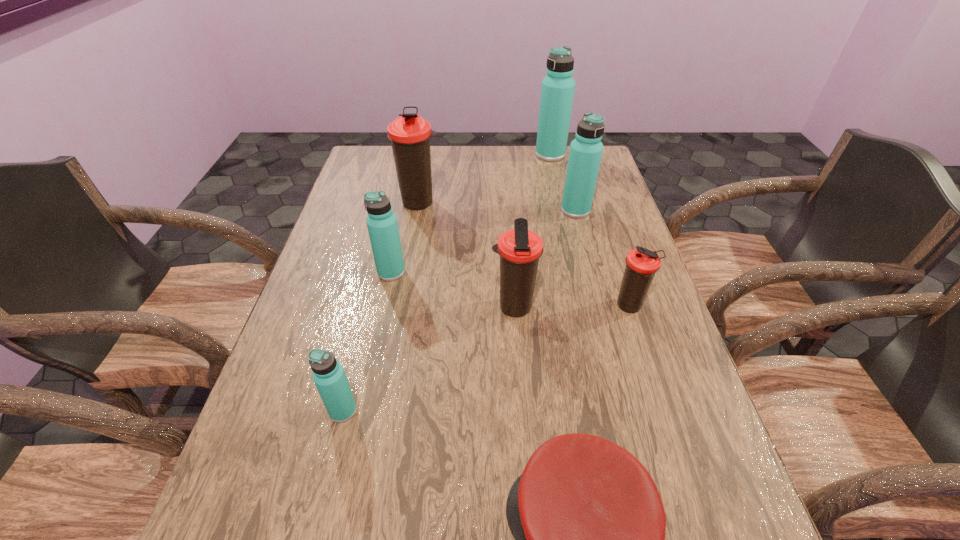
The height and width of the screenshot is (540, 960). Find the location of `the farthest aqua thermos bottle`. the farthest aqua thermos bottle is located at coordinates (557, 92).

Where is `the farthest object`? the farthest object is located at coordinates (557, 92).

Locate an element on the screen. the farthest brown thermos bottle is located at coordinates (410, 134).

Locate an element on the screen. The image size is (960, 540). the leftmost brown thermos bottle is located at coordinates (410, 134).

This screenshot has height=540, width=960. I want to click on the third smallest aqua thermos bottle, so click(586, 149).

I want to click on the fourth thermos bottle from left to right, so click(520, 249).

I want to click on the second smallest brown thermos bottle, so click(x=520, y=249).

At what (x,y) coordinates should I click in order to perform the action: click on the third farthest aqua thermos bottle. Please return your answer as a coordinate pair (x, y). Looking at the image, I should click on (382, 225).

Identify the location of the fourth farthest object. click(x=382, y=225).

Find the location of a particular element. This screenshot has height=540, width=960. the seventh farthest object is located at coordinates (328, 375).